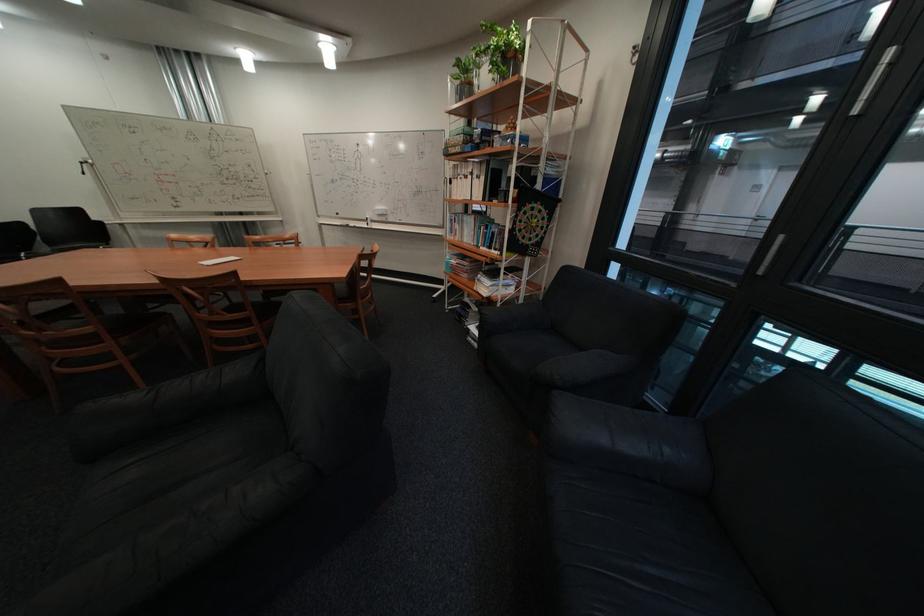
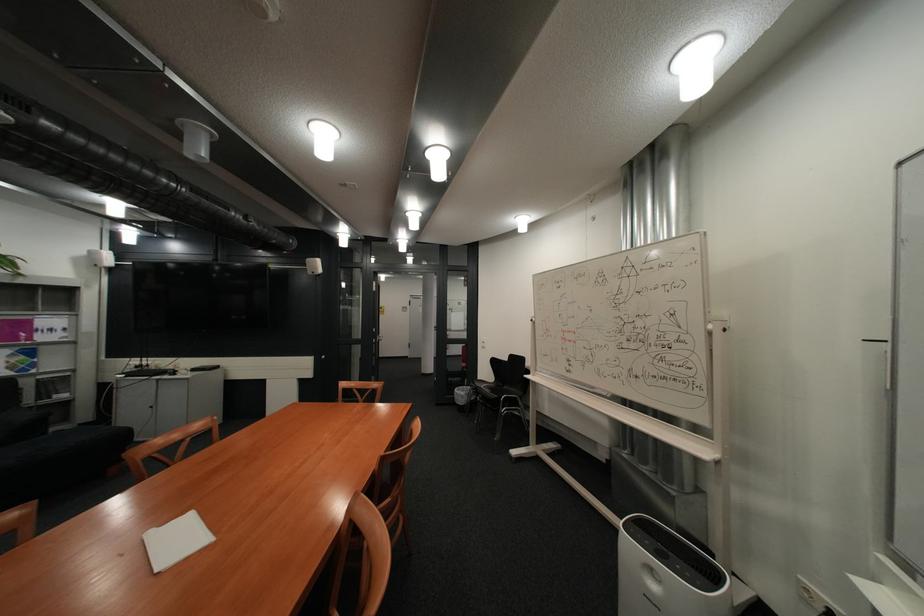
Locate, in the second image, the point that corresponds to (x=282, y=172) in the first image.

(725, 326)